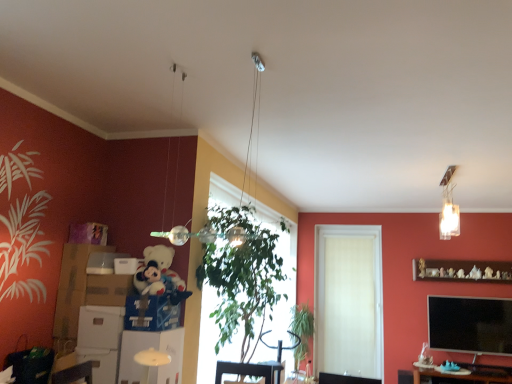
Question: Is white cardboard box at lower left, placed as the 1th cardboard box when sorted from left to right, positioned far away from metallic silver swivel chair at center?

Choices:
 (A) no
 (B) yes

Answer: (B)

Question: Is white cardboard box at lower left, placed as the 3th cardboard box when sorted from right to left, wider than metallic silver swivel chair at center?

Choices:
 (A) yes
 (B) no

Answer: (B)

Question: Is the position of white cardboard box at lower left, placed as the 3th cardboard box when sorted from right to left, less distant than that of metallic silver swivel chair at center?

Choices:
 (A) yes
 (B) no

Answer: (A)

Question: Is white cardboard box at lower left, placed as the 3th cardboard box when sorted from right to left, outside of metallic silver swivel chair at center?

Choices:
 (A) yes
 (B) no

Answer: (A)

Question: Does white cardboard box at lower left, placed as the 1th cardboard box when sorted from left to right, have a larger size compared to metallic silver swivel chair at center?

Choices:
 (A) no
 (B) yes

Answer: (A)

Question: Is white cardboard box at lower left, placed as the 1th cardboard box when sorted from left to right, smaller than metallic silver swivel chair at center?

Choices:
 (A) yes
 (B) no

Answer: (A)

Question: From a real-world perspective, does metallic silver swivel chair at center sit lower than white glossy shelf at lower center, acting as the first shelf starting from the front?

Choices:
 (A) yes
 (B) no

Answer: (A)

Question: From the image's perspective, does metallic silver swivel chair at center appear lower than white glossy shelf at lower center, which appears as the 1th shelf when viewed from the left?

Choices:
 (A) yes
 (B) no

Answer: (A)

Question: From the image's perspective, is metallic silver swivel chair at center over white glossy shelf at lower center, which appears as the 1th shelf when viewed from the left?

Choices:
 (A) yes
 (B) no

Answer: (B)

Question: Is metallic silver swivel chair at center not inside white glossy shelf at lower center, which appears as the 1th shelf when viewed from the left?

Choices:
 (A) yes
 (B) no

Answer: (A)

Question: Is metallic silver swivel chair at center positioned behind white glossy shelf at lower center, marked as the second shelf in a right-to-left arrangement?

Choices:
 (A) yes
 (B) no

Answer: (A)

Question: Is metallic silver swivel chair at center facing towards white glossy shelf at lower center, which appears as the 1th shelf when viewed from the left?

Choices:
 (A) no
 (B) yes

Answer: (A)

Question: Is white matte door at center wider than matte cardboard box at left, which appears as the first box when ordered from the bottom?

Choices:
 (A) yes
 (B) no

Answer: (B)